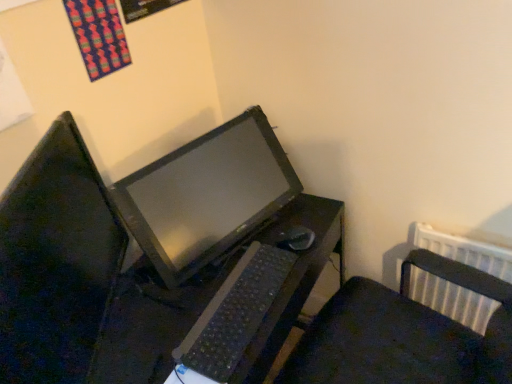
You are a GUI agent. You are given a task and a screenshot of the screen. Output one action in this format:
    pyautogui.click(x=<x>, y=<y>)
    Task: Click on the free space behind black plastic mouse at center
    The image size is (512, 384).
    Given the screenshot: What is the action you would take?
    pyautogui.click(x=288, y=213)